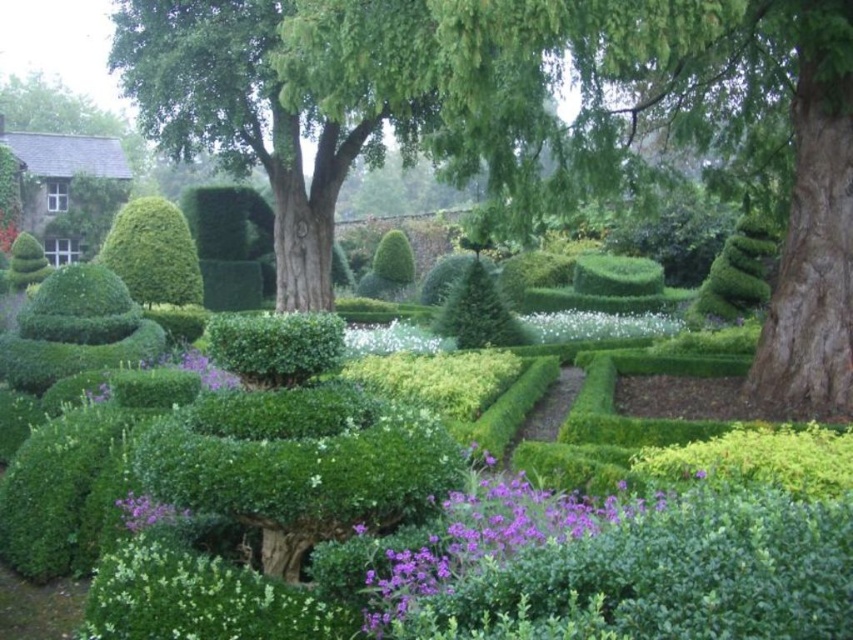
You are a gardener planning to plant a new flower between the white matte flower at center and the purple matte flower at lower left. Based on their current positions, which flower should you use as a reference point to ensure the new flower is placed correctly?

The purple matte flower at lower left should be used as the reference point because the white matte flower at center is positioned to its right, so placing the new flower between them would require aligning it from the purple matte flower at lower left towards the white matte flower at center.